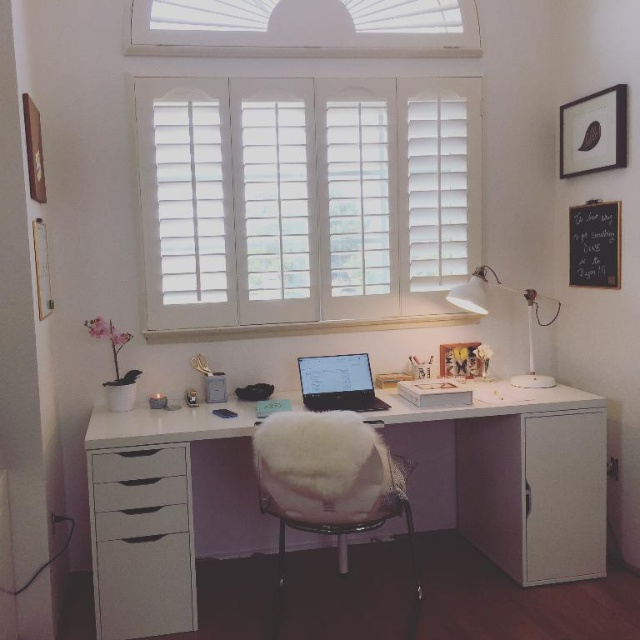
Can you confirm if white glossy computer desk at center is positioned below white wood window at upper center?

Yes, white glossy computer desk at center is below white wood window at upper center.

Which of these two, white glossy computer desk at center or white wood window at upper center, stands taller?

white glossy computer desk at center is taller.

This screenshot has width=640, height=640. Identify the location of white glossy computer desk at center. (524, 476).

You are a GUI agent. You are given a task and a screenshot of the screen. Output one action in this format:
    pyautogui.click(x=<x>, y=<y>)
    Task: Click on the white glossy computer desk at center
    
    Given the screenshot: What is the action you would take?
    pyautogui.click(x=524, y=476)

Describe the element at coordinates (305, 198) in the screenshot. The image size is (640, 640). I see `white wooden shutters at upper center` at that location.

Who is more forward, [344,205] or [180,560]?

Positioned in front is point [180,560].

Locate an element on the screen. This screenshot has height=640, width=640. white wooden shutters at upper center is located at coordinates (305, 198).

Does white wood window at upper center have a greater width compared to white plastic desk lamp at upper right?

Yes, white wood window at upper center is wider than white plastic desk lamp at upper right.

Who is higher up, white wood window at upper center or white plastic desk lamp at upper right?

Positioned higher is white wood window at upper center.

Is point (196, 6) more distant than point (525, 307)?

No, it is not.

The height and width of the screenshot is (640, 640). I want to click on white wood window at upper center, so click(x=304, y=28).